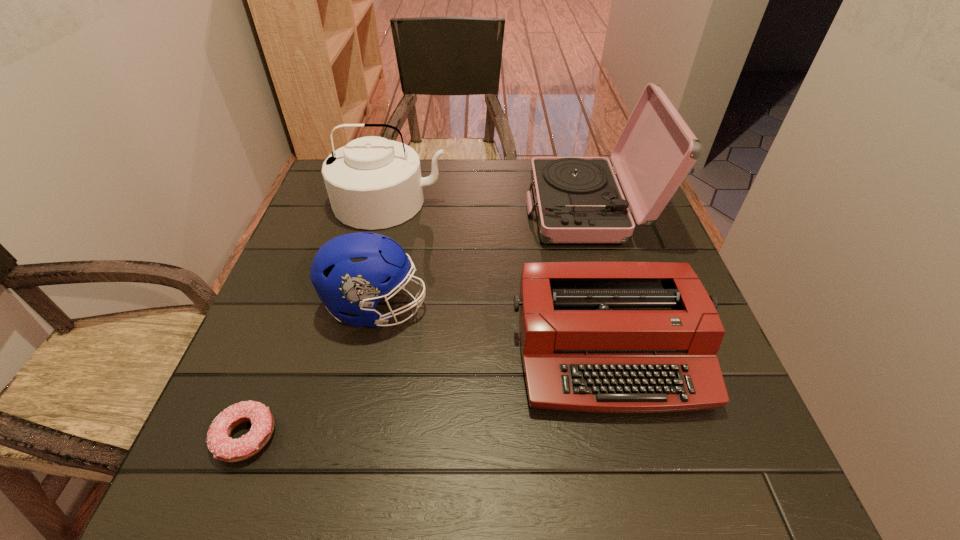
Identify the location of free space located on the typing side of the typewriter. This screenshot has height=540, width=960. (641, 478).

Locate an element on the screen. This screenshot has width=960, height=540. free region located 0.340m on the right of the doughnut is located at coordinates (480, 436).

The height and width of the screenshot is (540, 960). Identify the location of record player that is at the far edge. (578, 200).

Locate an element on the screen. Image resolution: width=960 pixels, height=540 pixels. kettle present at the far edge is located at coordinates (373, 183).

Find the location of `object that is at the near edge`. object that is at the near edge is located at coordinates (224, 448).

In order to click on kettle that is positioned at the left edge in this screenshot , I will do `click(373, 183)`.

Identify the location of football helmet present at the left edge. (351, 273).

Identify the location of doughnut that is positioned at the left edge. The image size is (960, 540). (224, 448).

Where is `record player situated at the right edge`? This screenshot has width=960, height=540. record player situated at the right edge is located at coordinates (578, 200).

Image resolution: width=960 pixels, height=540 pixels. In order to click on typewriter positioned at the right edge in this screenshot , I will do `click(607, 337)`.